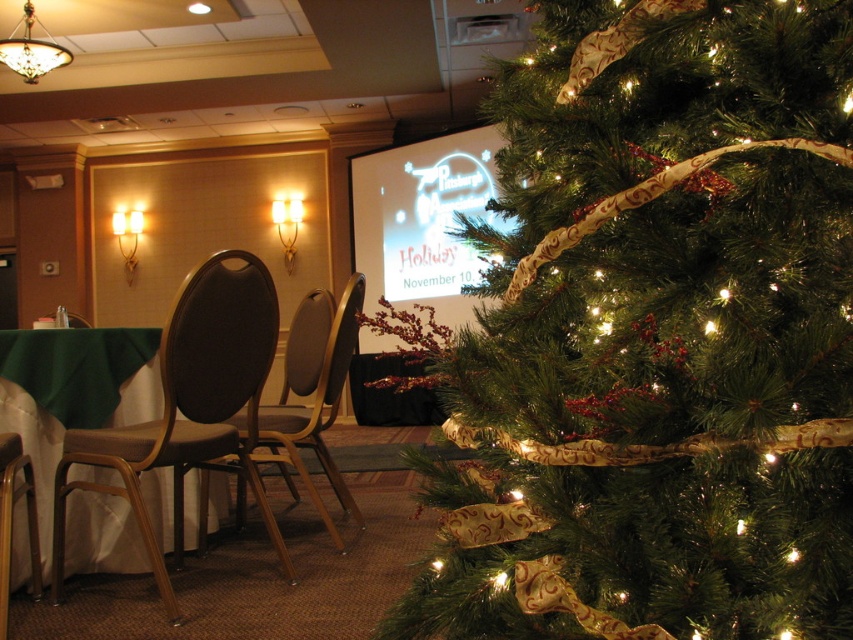
Is brown fabric chair at left further to camera compared to green fabric tablecloth at lower left?

No.

Can you confirm if brown fabric chair at left is thinner than green fabric tablecloth at lower left?

In fact, brown fabric chair at left might be wider than green fabric tablecloth at lower left.

Is point (135, 470) in front of point (16, 368)?

Yes, point (135, 470) is in front of point (16, 368).

Locate an element on the screen. The height and width of the screenshot is (640, 853). brown fabric chair at left is located at coordinates (190, 410).

Is green textured christmas tree at right positioned at the back of matte brown chair at left?

No.

Which is in front, point (717, 566) or point (354, 339)?

Point (717, 566) is more forward.

Between point (640, 250) and point (318, 346), which one is positioned in front?

Point (640, 250) is more forward.

You are a GUI agent. You are given a task and a screenshot of the screen. Output one action in this format:
    pyautogui.click(x=<x>, y=<y>)
    Task: Click on the green textured christmas tree at right
    The height and width of the screenshot is (640, 853).
    Given the screenshot: What is the action you would take?
    pyautogui.click(x=656, y=337)

Does green textured christmas tree at right have a larger size compared to green fabric tablecloth at lower left?

Correct, green textured christmas tree at right is larger in size than green fabric tablecloth at lower left.

The image size is (853, 640). Identify the location of green textured christmas tree at right. (656, 337).

Is point (592, 342) farther from viewer compared to point (157, 388)?

No.

Where is `green textured christmas tree at right`? This screenshot has width=853, height=640. green textured christmas tree at right is located at coordinates (656, 337).